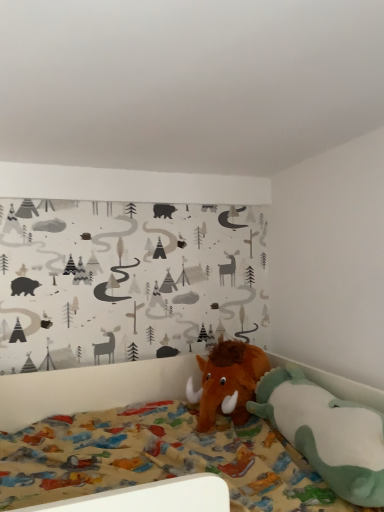
Question: From the image's perspective, is brown plush mammoth at lower right, which is the second toy in back-to-front order, over brown plush mammoth at center, which is the first toy in back-to-front order?

Choices:
 (A) no
 (B) yes

Answer: (A)

Question: Is brown plush mammoth at lower right, arranged as the first toy when viewed from the front, to the right of brown plush mammoth at center, which is the second toy from front to back, from the viewer's perspective?

Choices:
 (A) no
 (B) yes

Answer: (B)

Question: Can you confirm if brown plush mammoth at lower right, arranged as the first toy when viewed from the front, is smaller than brown plush mammoth at center, which is the second toy from front to back?

Choices:
 (A) yes
 (B) no

Answer: (B)

Question: Is brown plush mammoth at lower right, which is the second toy in back-to-front order, bigger than brown plush mammoth at center, which is the first toy in back-to-front order?

Choices:
 (A) yes
 (B) no

Answer: (A)

Question: Can we say brown plush mammoth at lower right, which is the second toy in back-to-front order, lies outside brown plush mammoth at center, which is the first toy in back-to-front order?

Choices:
 (A) yes
 (B) no

Answer: (A)

Question: Is brown plush mammoth at lower right, arranged as the first toy when viewed from the front, behind brown plush mammoth at center, which is the first toy in back-to-front order?

Choices:
 (A) no
 (B) yes

Answer: (A)

Question: Could you tell me if brown plush mammoth at center, which is the first toy in back-to-front order, is facing brown plush mammoth at lower right, arranged as the first toy when viewed from the front?

Choices:
 (A) yes
 (B) no

Answer: (A)

Question: From the image's perspective, is brown plush mammoth at center, which is the first toy in back-to-front order, located above brown plush mammoth at lower right, arranged as the first toy when viewed from the front?

Choices:
 (A) no
 (B) yes

Answer: (B)

Question: Is brown plush mammoth at center, which is the first toy in back-to-front order, positioned behind brown plush mammoth at lower right, which is the second toy in back-to-front order?

Choices:
 (A) no
 (B) yes

Answer: (B)

Question: Is brown plush mammoth at center, which is the first toy in back-to-front order, not within brown plush mammoth at lower right, arranged as the first toy when viewed from the front?

Choices:
 (A) no
 (B) yes

Answer: (B)

Question: From a real-world perspective, is brown plush mammoth at center, which is the second toy from front to back, physically above brown plush mammoth at lower right, arranged as the first toy when viewed from the front?

Choices:
 (A) no
 (B) yes

Answer: (B)

Question: Does brown plush mammoth at center, which is the first toy in back-to-front order, appear on the right side of brown plush mammoth at lower right, which is the second toy in back-to-front order?

Choices:
 (A) yes
 (B) no

Answer: (B)

Question: Is brown plush mammoth at lower right, which is the second toy in back-to-front order, inside the boundaries of brown plush mammoth at center, which is the first toy in back-to-front order, or outside?

Choices:
 (A) outside
 (B) inside

Answer: (A)